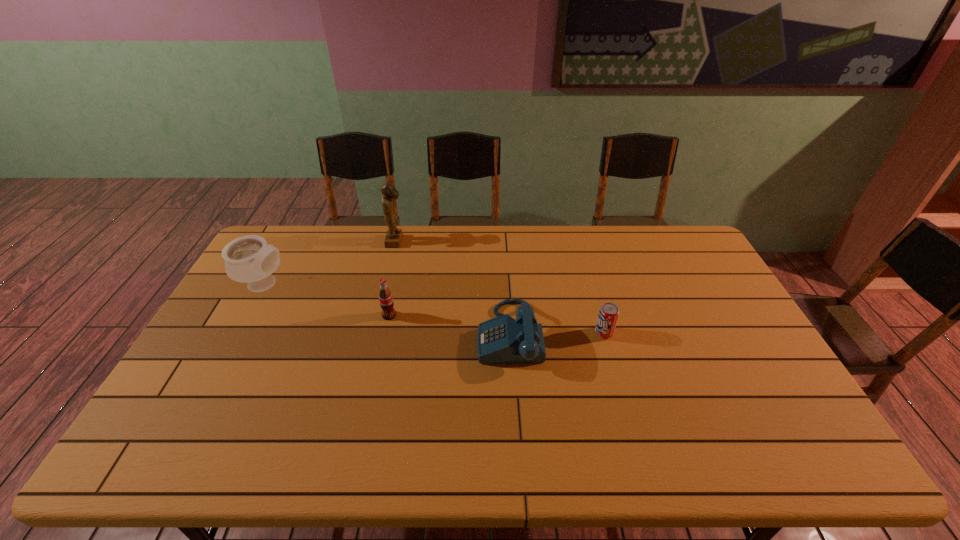
Locate an element on the screen. Image resolution: width=960 pixels, height=540 pixels. the third closest object relative to the pottery is located at coordinates (502, 339).

You are a GUI agent. You are given a task and a screenshot of the screen. Output one action in this format:
    pyautogui.click(x=<x>, y=<y>)
    Task: Click on the object that is the closest to the farthest object
    This screenshot has width=960, height=540.
    Given the screenshot: What is the action you would take?
    pyautogui.click(x=249, y=258)

Where is `free space that satisfies the following two spatial constraints: 1. on the front-facing side of the figurine; 2. on the right side of the shorter soda can`? The width and height of the screenshot is (960, 540). free space that satisfies the following two spatial constraints: 1. on the front-facing side of the figurine; 2. on the right side of the shorter soda can is located at coordinates (373, 333).

Locate an element on the screen. blank area in the image that satisfies the following two spatial constraints: 1. on the front-facing side of the nearer soda can; 2. on the left side of the farthest object is located at coordinates click(x=373, y=333).